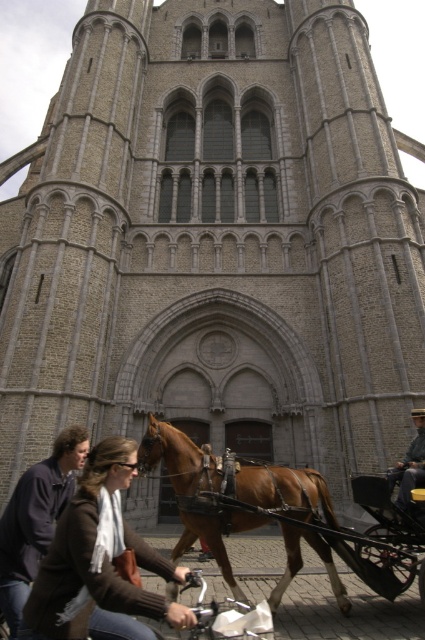
You are a photographer standing in front of the historic building. You want to take a photo that includes both the brown leather jacket at lower left and the wooden cart at lower right. Which object should you adjust your camera angle to focus on first to ensure both are in frame?

Since the brown leather jacket at lower left is larger in size compared to the wooden cart at lower right, you should focus on the brown leather jacket at lower left first to ensure both objects fit within the frame.

You are a tourist standing in front of the historic building and notice both the brown leather jacket at lower left and the wooden cart at lower right. Which object is positioned higher up in the image?

The brown leather jacket at lower left is located above the wooden cart at lower right in the image.

You are a tourist standing on the sidewalk in front of the historic building. You see the brown glossy horse at center and the wooden cart at lower right. Which object is closer to the left side of the street?

The brown glossy horse at center is positioned on the left side of wooden cart at lower right, so it is closer to the left side of the street.